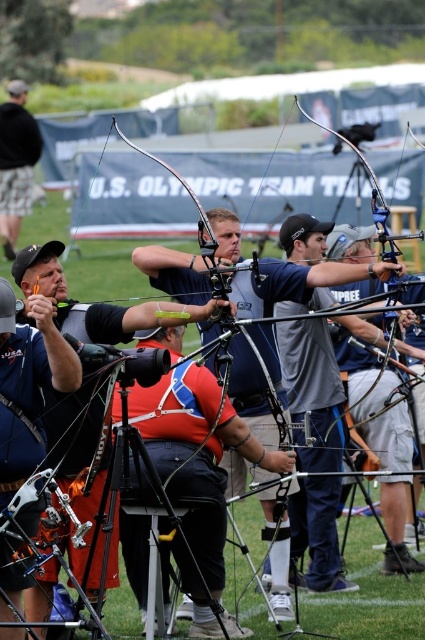
You are an archer in the competition and you need to position yourself so that your bowstring is not obstructed by the matte black camera at left or the black fabric jacket at upper left. Which object should you be more cautious about avoiding due to its larger size?

The black fabric jacket at upper left is larger than the matte black camera at left, so you should be more cautious about avoiding it to prevent obstructing your bowstring.

You are an archer preparing to shoot your arrow. You notice a matte black camera at left and a black fabric jacket at upper left in your line of sight. Which object is nearer to you?

The matte black camera at left is closer to the viewer than the black fabric jacket at upper left, so the matte black camera at left is nearer to you.

You are an archer preparing to shoot your arrow. You notice a matte black camera at left and a black fabric jacket at upper left in your line of sight. Which object is shorter in height?

The matte black camera at left is not as tall as the black fabric jacket at upper left, so the matte black camera at left is shorter in height.